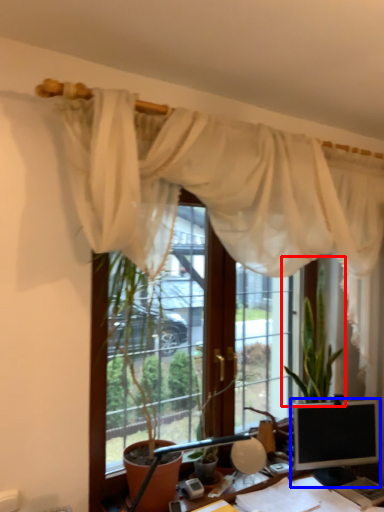
Question: Which of the following is the farthest to the observer, houseplant (highlighted by a red box) or computer monitor (highlighted by a blue box)?

Choices:
 (A) houseplant
 (B) computer monitor

Answer: (A)